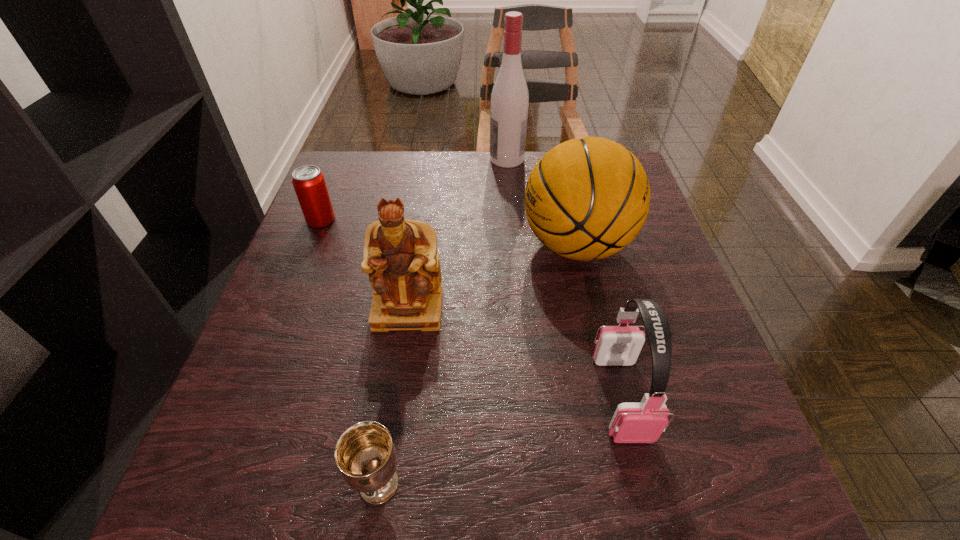
Identify the location of blank region between the fifth farthest object and the basketball. This screenshot has width=960, height=540. (599, 321).

You are a GUI agent. You are given a task and a screenshot of the screen. Output one action in this format:
    pyautogui.click(x=<x>, y=<y>)
    Task: Click on the vacant space that's between the alcohol and the can
    This screenshot has height=540, width=960.
    Given the screenshot: What is the action you would take?
    pyautogui.click(x=414, y=190)

At what (x,y) coordinates should I click in order to perform the action: click on free space that is in between the fourth farthest object and the chalice. Please return your answer as a coordinate pair (x, y). This screenshot has width=960, height=540. Looking at the image, I should click on (394, 396).

Find the location of a particular element. vacant point located between the fourth farthest object and the tallest object is located at coordinates (458, 234).

The height and width of the screenshot is (540, 960). Identify the location of vacant region between the figurine and the third shortest object. (515, 353).

You are a GUI agent. You are given a task and a screenshot of the screen. Output one action in this format:
    pyautogui.click(x=<x>, y=<y>)
    Task: Click on the vacant area between the leftmost object and the chalice
    
    Given the screenshot: What is the action you would take?
    pyautogui.click(x=350, y=352)

You are a GUI agent. You are given a task and a screenshot of the screen. Output one action in this format:
    pyautogui.click(x=<x>, y=<y>)
    Task: Click on the vacant space that is in between the second nearest object and the nearest object
    The height and width of the screenshot is (540, 960).
    Given the screenshot: What is the action you would take?
    pyautogui.click(x=500, y=440)

I want to click on free space between the chalice and the leftmost object, so click(350, 352).

What are the coordinates of `empty space that is in between the tallest object and the nearest object` in the screenshot? It's located at (443, 322).

Identify which object is located as the third nearest to the fifth farthest object. Please provide its 2D coordinates. Your answer should be formatted as a tuple, i.e. [(x, y)], where the tuple contains the x and y coordinates of a point satisfying the conditions above.

[(364, 453)]